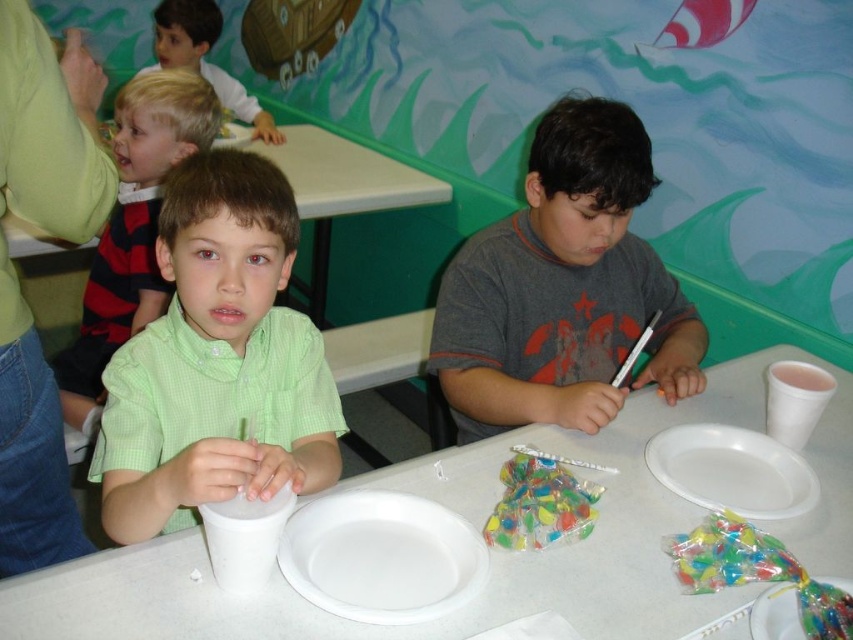
Question: Among these objects, which one is farthest from the camera?

Choices:
 (A) translucent plastic candy at center
 (B) white matte paper cup at lower left

Answer: (A)

Question: Does white paper plate at center appear over translucent plastic candy at lower right?

Choices:
 (A) yes
 (B) no

Answer: (A)

Question: Can you confirm if gray matte shirt at center is positioned to the right of translucent plastic candy at lower right?

Choices:
 (A) yes
 (B) no

Answer: (B)

Question: Can you confirm if green checkered shirt at center is positioned below white plastic plate at lower right?

Choices:
 (A) yes
 (B) no

Answer: (B)

Question: Among these objects, which one is farthest from the camera?

Choices:
 (A) green checkered shirt at center
 (B) transparent plastic plate at center

Answer: (B)

Question: Which object appears closest to the camera in this image?

Choices:
 (A) white paper cup at upper right
 (B) translucent plastic candy at lower right
 (C) white paper plate at center

Answer: (C)